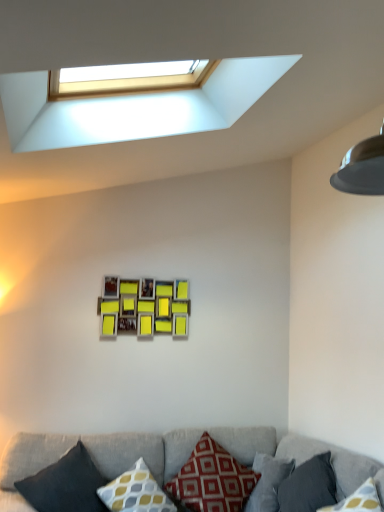
How much space does yellow and gray patterned pillow at center, which ranks as the 2th pillow in left-to-right order, occupy horizontally?

yellow and gray patterned pillow at center, which ranks as the 2th pillow in left-to-right order, is 14.54 inches wide.

I want to click on wooden photo frame at center, so click(x=144, y=307).

Describe the element at coordinates (358, 500) in the screenshot. I see `dark gray fabric pillow at lower right, which ranks as the 1th pillow in right-to-left order` at that location.

The image size is (384, 512). Identify the location of yellow and gray patterned pillow at center, which ranks as the 2th pillow in left-to-right order. (135, 492).

Considering the relative sizes of dark gray fabric pillow at lower right, which ranks as the 1th pillow in right-to-left order, and red cotton pillow at center, which is counted as the third pillow, starting from the left, in the image provided, is dark gray fabric pillow at lower right, which ranks as the 1th pillow in right-to-left order, shorter than red cotton pillow at center, which is counted as the third pillow, starting from the left,?

Yes, dark gray fabric pillow at lower right, which ranks as the 1th pillow in right-to-left order, is shorter than red cotton pillow at center, which is counted as the third pillow, starting from the left.

Does dark gray fabric pillow at lower right, arranged as the 5th pillow when viewed from the left, have a larger size compared to red cotton pillow at center, which is counted as the third pillow, starting from the left?

No, dark gray fabric pillow at lower right, arranged as the 5th pillow when viewed from the left, is not bigger than red cotton pillow at center, which is counted as the third pillow, starting from the left.

From the picture: From a real-world perspective, between dark gray fabric pillow at lower right, arranged as the 5th pillow when viewed from the left, and red cotton pillow at center, which is counted as the third pillow, starting from the left, who is vertically higher?

In real-world perspective, dark gray fabric pillow at lower right, arranged as the 5th pillow when viewed from the left, is above.

Consider the image. How different are the orientations of dark gray fabric pillow at lower right, arranged as the 5th pillow when viewed from the left, and red cotton pillow at center, which is the 3th pillow from right to left, in degrees?

The angle between the facing direction of dark gray fabric pillow at lower right, arranged as the 5th pillow when viewed from the left, and the facing direction of red cotton pillow at center, which is the 3th pillow from right to left, is 90 degrees.

Is red cotton pillow at center, which is counted as the third pillow, starting from the left, facing away from dark gray fabric pillow at lower left, which ranks as the 5th pillow in right-to-left order?

No, red cotton pillow at center, which is counted as the third pillow, starting from the left, is not facing away from dark gray fabric pillow at lower left, which ranks as the 5th pillow in right-to-left order.

From the image's perspective, does red cotton pillow at center, which is counted as the third pillow, starting from the left, appear higher than dark gray fabric pillow at lower left, which ranks as the 5th pillow in right-to-left order?

No, from the image's perspective, red cotton pillow at center, which is counted as the third pillow, starting from the left, is not above dark gray fabric pillow at lower left, which ranks as the 5th pillow in right-to-left order.

Based on the photo, which is closer, [187,469] or [64,463]?

Point [187,469] is positioned farther from the camera compared to point [64,463].

Is red cotton pillow at center, which is counted as the third pillow, starting from the left, at the left side of dark gray fabric pillow at lower left, which ranks as the 5th pillow in right-to-left order?

No.

Considering the relative positions of dark gray fabric pillow at lower right, which ranks as the 1th pillow in right-to-left order, and wooden photo frame at center in the image provided, is dark gray fabric pillow at lower right, which ranks as the 1th pillow in right-to-left order, behind wooden photo frame at center?

No, it is in front of wooden photo frame at center.

Does dark gray fabric pillow at lower right, which ranks as the 1th pillow in right-to-left order, have a greater width compared to wooden photo frame at center?

Indeed, dark gray fabric pillow at lower right, which ranks as the 1th pillow in right-to-left order, has a greater width compared to wooden photo frame at center.

From the image's perspective, which is below, dark gray fabric pillow at lower right, arranged as the 5th pillow when viewed from the left, or wooden photo frame at center?

dark gray fabric pillow at lower right, arranged as the 5th pillow when viewed from the left.

You are a GUI agent. You are given a task and a screenshot of the screen. Output one action in this format:
    pyautogui.click(x=<x>, y=<y>)
    Task: Click on the 2nd pillow to the right of the textured gray couch at lower center, starting your count from the anchor
    The width and height of the screenshot is (384, 512).
    Given the screenshot: What is the action you would take?
    pyautogui.click(x=309, y=486)

From a real-world perspective, is dark gray fabric pillow at lower right, placed as the 2th pillow when sorted from right to left, located beneath textured gray couch at lower center?

No, from a real-world perspective, dark gray fabric pillow at lower right, placed as the 2th pillow when sorted from right to left, is not beneath textured gray couch at lower center.

Is dark gray fabric pillow at lower right, placed as the 2th pillow when sorted from right to left, touching textured gray couch at lower center?

dark gray fabric pillow at lower right, placed as the 2th pillow when sorted from right to left, and textured gray couch at lower center are not in contact.

Is dark gray fabric pillow at lower right, which is the 4th pillow in left-to-right order, thinner than textured gray couch at lower center?

Indeed, dark gray fabric pillow at lower right, which is the 4th pillow in left-to-right order, has a lesser width compared to textured gray couch at lower center.

From a real-world perspective, is dark gray fabric pillow at lower left, the 1th pillow from the left, located beneath textured gray couch at lower center?

No.

Which of these two, dark gray fabric pillow at lower left, which ranks as the 5th pillow in right-to-left order, or textured gray couch at lower center, is smaller?

dark gray fabric pillow at lower left, which ranks as the 5th pillow in right-to-left order, is smaller.

Which of these two, dark gray fabric pillow at lower left, the 1th pillow from the left, or textured gray couch at lower center, is thinner?

dark gray fabric pillow at lower left, the 1th pillow from the left.

Considering the sizes of objects dark gray fabric pillow at lower left, the 1th pillow from the left, and textured gray couch at lower center in the image provided, who is taller, dark gray fabric pillow at lower left, the 1th pillow from the left, or textured gray couch at lower center?

textured gray couch at lower center is taller.

Does yellow and gray patterned pillow at center, which ranks as the 2th pillow in left-to-right order, have a lesser height compared to dark gray fabric pillow at lower right, which is the 4th pillow in left-to-right order?

Indeed, yellow and gray patterned pillow at center, which ranks as the 2th pillow in left-to-right order, has a lesser height compared to dark gray fabric pillow at lower right, which is the 4th pillow in left-to-right order.

Are yellow and gray patterned pillow at center, which appears as the 4th pillow when viewed from the right, and dark gray fabric pillow at lower right, placed as the 2th pillow when sorted from right to left, far apart?

No, yellow and gray patterned pillow at center, which appears as the 4th pillow when viewed from the right, is in close proximity to dark gray fabric pillow at lower right, placed as the 2th pillow when sorted from right to left.

Which point is more distant from viewer, (141, 465) or (310, 511)?

The point (141, 465) is farther.

Which is less distant, [145,496] or [201,455]?

Point [145,496] is closer to the camera than point [201,455].

Is yellow and gray patterned pillow at center, which ranks as the 2th pillow in left-to-right order, completely or partially outside of red cotton pillow at center, which is the 3th pillow from right to left?

Yes.

Between yellow and gray patterned pillow at center, which appears as the 4th pillow when viewed from the right, and red cotton pillow at center, which is counted as the third pillow, starting from the left, which one appears on the left side from the viewer's perspective?

From the viewer's perspective, yellow and gray patterned pillow at center, which appears as the 4th pillow when viewed from the right, appears more on the left side.

This screenshot has width=384, height=512. I want to click on pillow that is the 4th object located in front of the red cotton pillow at center, which is counted as the third pillow, starting from the left, so click(x=358, y=500).

The image size is (384, 512). I want to click on pillow directly beneath the red cotton pillow at center, which is the 3th pillow from right to left (from a real-world perspective), so click(x=66, y=484).

Looking at the image, which one is located closer to dark gray fabric pillow at lower right, arranged as the 5th pillow when viewed from the left, wooden photo frame at center or white plastic window at upper center?

The object closer to dark gray fabric pillow at lower right, arranged as the 5th pillow when viewed from the left, is wooden photo frame at center.

Consider the image. Based on their spatial positions, is yellow and gray patterned pillow at center, which ranks as the 2th pillow in left-to-right order, or red cotton pillow at center, which is counted as the third pillow, starting from the left, further from textured gray couch at lower center?

Based on the image, yellow and gray patterned pillow at center, which ranks as the 2th pillow in left-to-right order, appears to be further to textured gray couch at lower center.

From the image, which object appears to be nearer to dark gray fabric pillow at lower left, which ranks as the 5th pillow in right-to-left order, white plastic window at upper center or dark gray fabric pillow at lower right, arranged as the 5th pillow when viewed from the left?

dark gray fabric pillow at lower right, arranged as the 5th pillow when viewed from the left.

Considering their positions, is dark gray fabric pillow at lower right, arranged as the 5th pillow when viewed from the left, positioned closer to red cotton pillow at center, which is counted as the third pillow, starting from the left, than white plastic window at upper center?

The object closer to red cotton pillow at center, which is counted as the third pillow, starting from the left, is dark gray fabric pillow at lower right, arranged as the 5th pillow when viewed from the left.

From the picture: When comparing their distances from yellow and gray patterned pillow at center, which ranks as the 2th pillow in left-to-right order, does dark gray fabric pillow at lower right, which is the 4th pillow in left-to-right order, or wooden photo frame at center seem further?

Among the two, wooden photo frame at center is located further to yellow and gray patterned pillow at center, which ranks as the 2th pillow in left-to-right order.

Based on their spatial positions, is dark gray fabric pillow at lower right, which is the 4th pillow in left-to-right order, or dark gray fabric pillow at lower right, which ranks as the 1th pillow in right-to-left order, closer to white plastic window at upper center?

dark gray fabric pillow at lower right, which is the 4th pillow in left-to-right order, is closer to white plastic window at upper center.

Which object lies nearer to the anchor point dark gray fabric pillow at lower right, which ranks as the 1th pillow in right-to-left order, wooden photo frame at center or yellow and gray patterned pillow at center, which ranks as the 2th pillow in left-to-right order?

Among the two, yellow and gray patterned pillow at center, which ranks as the 2th pillow in left-to-right order, is located nearer to dark gray fabric pillow at lower right, which ranks as the 1th pillow in right-to-left order.

Based on their spatial positions, is yellow and gray patterned pillow at center, which appears as the 4th pillow when viewed from the right, or dark gray fabric pillow at lower left, which ranks as the 5th pillow in right-to-left order, closer to textured gray couch at lower center?

dark gray fabric pillow at lower left, which ranks as the 5th pillow in right-to-left order, lies closer to textured gray couch at lower center than the other object.

The height and width of the screenshot is (512, 384). Find the location of `picture frame between white plastic window at upper center and dark gray fabric pillow at lower right, placed as the 2th pillow when sorted from right to left, vertically`. picture frame between white plastic window at upper center and dark gray fabric pillow at lower right, placed as the 2th pillow when sorted from right to left, vertically is located at coordinates (144, 307).

Where is `pillow located between dark gray fabric pillow at lower left, the 1th pillow from the left, and red cotton pillow at center, which is the 3th pillow from right to left, in the left-right direction`? pillow located between dark gray fabric pillow at lower left, the 1th pillow from the left, and red cotton pillow at center, which is the 3th pillow from right to left, in the left-right direction is located at coordinates (135, 492).

At what (x,y) coordinates should I click in order to perform the action: click on picture frame between white plastic window at upper center and textured gray couch at lower center from top to bottom. Please return your answer as a coordinate pair (x, y). Image resolution: width=384 pixels, height=512 pixels. Looking at the image, I should click on pyautogui.click(x=144, y=307).

Locate an element on the screen. This screenshot has width=384, height=512. picture frame that lies between white plastic window at upper center and red cotton pillow at center, which is counted as the third pillow, starting from the left, from top to bottom is located at coordinates (144, 307).